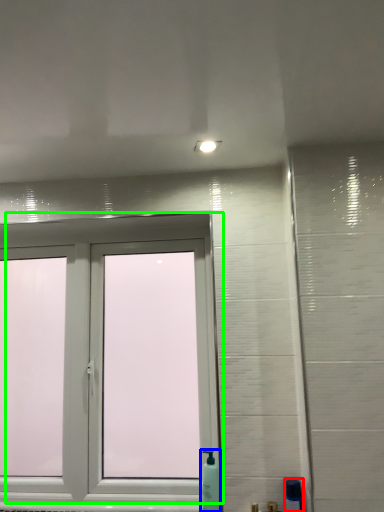
Question: Based on their relative distances, which object is farther from soap dispenser (highlighted by a red box)? Choose from soap dispenser (highlighted by a blue box) and window (highlighted by a green box).

Choices:
 (A) soap dispenser
 (B) window

Answer: (B)